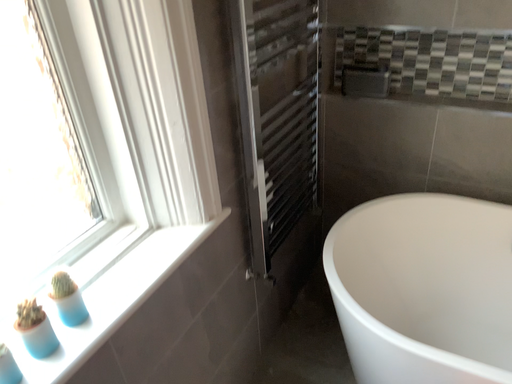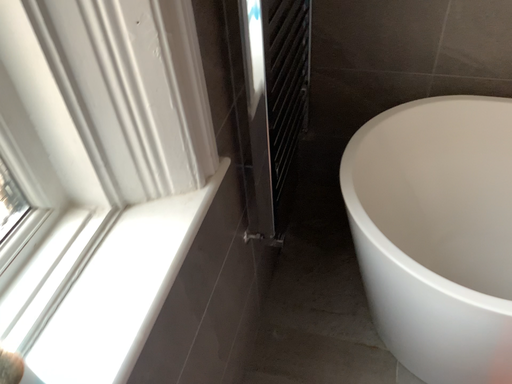
Question: Which way did the camera rotate in the video?

Choices:
 (A) rotated left
 (B) rotated right

Answer: (B)